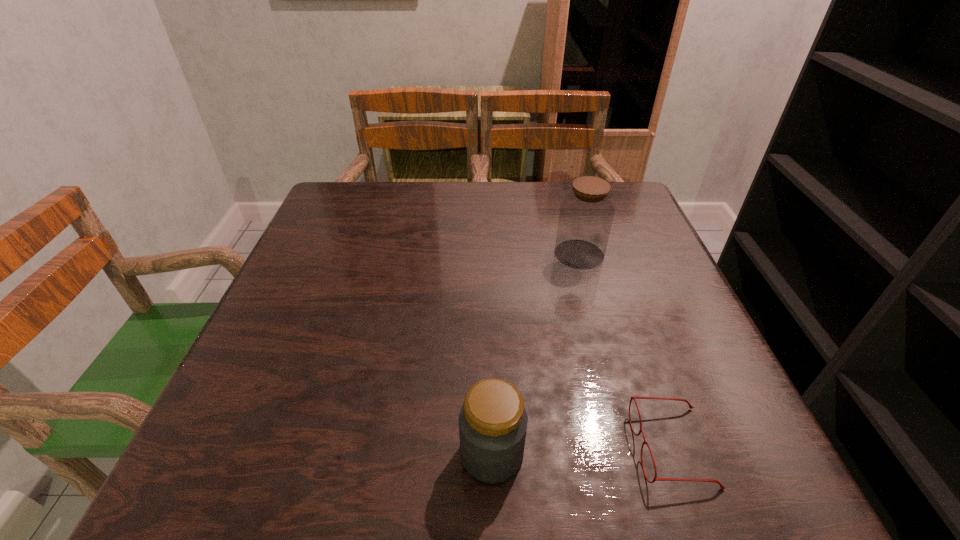
The image size is (960, 540). I want to click on free location at the right edge, so click(x=662, y=278).

Image resolution: width=960 pixels, height=540 pixels. In the image, there is a desktop. What are the coordinates of `vacant space at the far left corner` in the screenshot? It's located at (362, 230).

You are a GUI agent. You are given a task and a screenshot of the screen. Output one action in this format:
    pyautogui.click(x=<x>, y=<y>)
    Task: Click on the vacant space at the far right corner of the desktop
    The image size is (960, 540).
    Given the screenshot: What is the action you would take?
    pyautogui.click(x=638, y=227)

In the image, there is a desktop. Identify the location of vacant space at the near right corner. (731, 448).

You are a GUI agent. You are given a task and a screenshot of the screen. Output one action in this format:
    pyautogui.click(x=<x>, y=<y>)
    Task: Click on the free space between the second shortest object and the taller jar
    This screenshot has width=960, height=540.
    Given the screenshot: What is the action you would take?
    pyautogui.click(x=536, y=354)

Image resolution: width=960 pixels, height=540 pixels. I want to click on vacant area that lies between the spectacles and the left jar, so click(582, 450).

You are a GUI agent. You are given a task and a screenshot of the screen. Output one action in this format:
    pyautogui.click(x=<x>, y=<y>)
    Task: Click on the free point between the shortest object and the leftmost object
    The image size is (960, 540).
    Given the screenshot: What is the action you would take?
    pyautogui.click(x=582, y=450)

Where is `empty location between the shortest object and the second tallest object`? The height and width of the screenshot is (540, 960). empty location between the shortest object and the second tallest object is located at coordinates (582, 450).

The height and width of the screenshot is (540, 960). I want to click on free space between the shortest object and the nearer jar, so click(582, 450).

This screenshot has height=540, width=960. What are the coordinates of `free point between the shortest object and the left jar` in the screenshot? It's located at (582, 450).